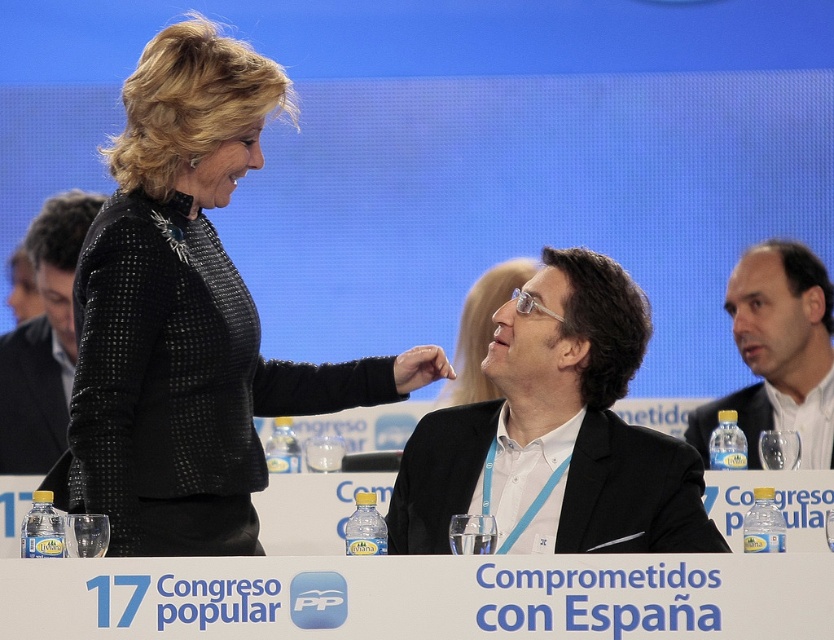
Is black matte suit at center wider than black textured blazer at upper left?

Indeed, black matte suit at center has a greater width compared to black textured blazer at upper left.

Is black matte suit at center taller than black textured blazer at upper left?

In fact, black matte suit at center may be shorter than black textured blazer at upper left.

Describe the element at coordinates (558, 428) in the screenshot. The height and width of the screenshot is (640, 834). I see `black matte suit at center` at that location.

Find the location of a particular element. This screenshot has width=834, height=640. black matte suit at center is located at coordinates (558, 428).

You are a GUI agent. You are given a task and a screenshot of the screen. Output one action in this format:
    pyautogui.click(x=<x>, y=<y>)
    Task: Click on the black matte suit at center
    The height and width of the screenshot is (640, 834).
    Given the screenshot: What is the action you would take?
    pyautogui.click(x=558, y=428)

At what (x,y) coordinates should I click in order to perform the action: click on black matte suit at center. Please return your answer as a coordinate pair (x, y). Looking at the image, I should click on (558, 428).

Who is higher up, black sequined jacket at upper left or black matte suit at center?

black sequined jacket at upper left is above.

Does black sequined jacket at upper left appear over black matte suit at center?

Yes, black sequined jacket at upper left is above black matte suit at center.

Locate an element on the screen. This screenshot has height=640, width=834. black sequined jacket at upper left is located at coordinates (188, 316).

Identify the location of black sequined jacket at upper left. click(188, 316).